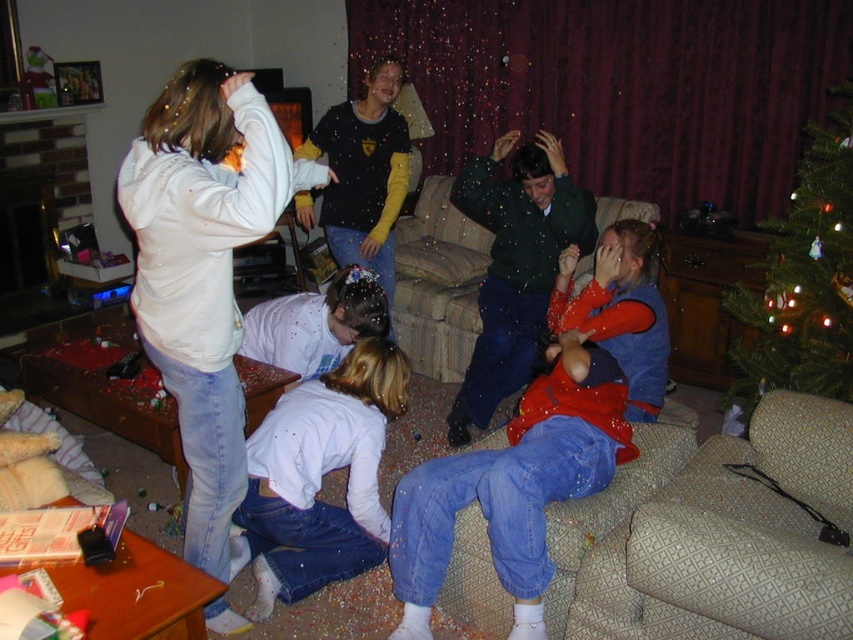
Which is below, dark green sweater at center or matte black shirt at center?

dark green sweater at center is lower down.

Who is more distant from viewer, [460,184] or [341,205]?

Point [341,205]

You are a GUI agent. You are given a task and a screenshot of the screen. Output one action in this format:
    pyautogui.click(x=<x>, y=<y>)
    Task: Click on the dark green sweater at center
    
    Given the screenshot: What is the action you would take?
    pyautogui.click(x=515, y=266)

Which is more to the left, matte white hoodie at upper left or matte black shirt at center?

matte black shirt at center

Does point (496, 333) come farther from viewer compared to point (399, 177)?

No, it is in front of (399, 177).

Is point (637, 401) farther from viewer compared to point (366, 209)?

No, it is in front of (366, 209).

Locate an element on the screen. matte white hoodie at upper left is located at coordinates (622, 308).

Does matte white hoodie at upper left have a larger size compared to white soft shirt at lower center?

Correct, matte white hoodie at upper left is larger in size than white soft shirt at lower center.

Is point (570, 253) positioned behind point (346, 432)?

Yes, point (570, 253) is behind point (346, 432).

Locate an element on the screen. matte white hoodie at upper left is located at coordinates (622, 308).